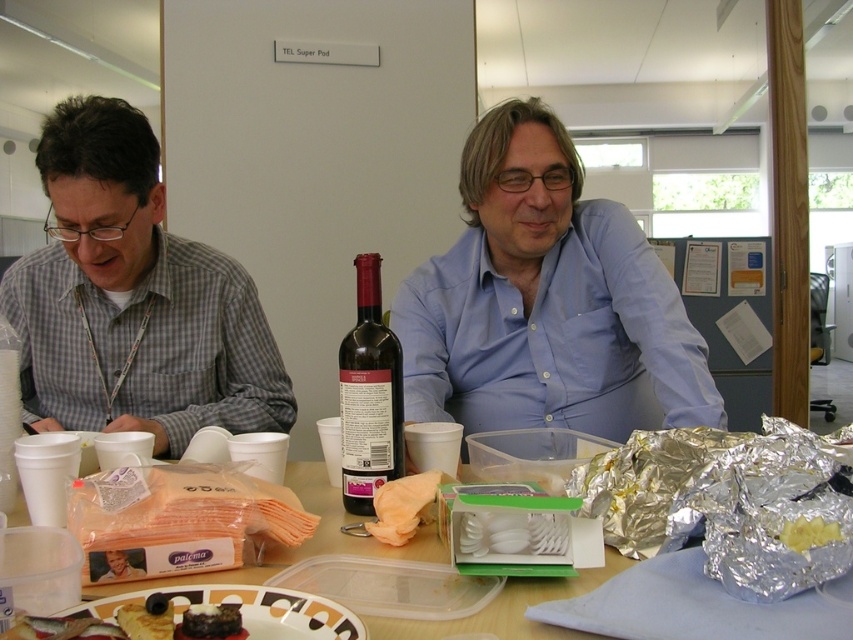
Question: Which of these objects is positioned farthest from the matte white plate at lower center?

Choices:
 (A) matte black shirt at left
 (B) orange napkins at center

Answer: (A)

Question: Which point is farther to the camera?

Choices:
 (A) (322, 625)
 (B) (318, 522)
 (C) (469, 417)
 (D) (74, 404)

Answer: (C)

Question: Does dark red glass bottle at center appear on the right side of brown crumbly cake at center?

Choices:
 (A) no
 (B) yes

Answer: (B)

Question: Which of the following is the farthest from the observer?

Choices:
 (A) matte white plate at lower center
 (B) gray checkered shirt at left

Answer: (B)

Question: Is matte black shirt at left wider than brown crumbly cake at center?

Choices:
 (A) no
 (B) yes

Answer: (B)

Question: Is matte black shirt at left above dark red glass bottle at center?

Choices:
 (A) yes
 (B) no

Answer: (A)